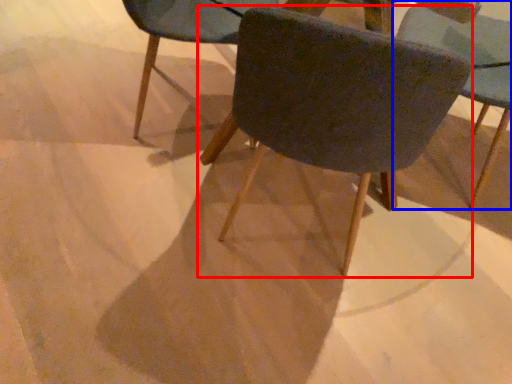
Question: Which object appears farthest to the camera in this image, chair (highlighted by a red box) or chair (highlighted by a blue box)?

Choices:
 (A) chair
 (B) chair

Answer: (B)